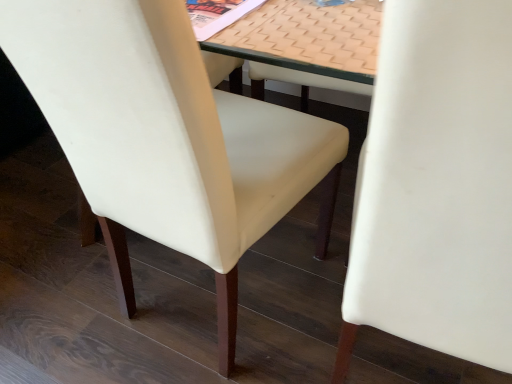
Question: Is the surface of white leather chair at center, which ranks as the 1th chair in right-to-left order, in direct contact with white leather chair at center, marked as the first chair in a left-to-right arrangement?

Choices:
 (A) yes
 (B) no

Answer: (B)

Question: Is white leather chair at center, which ranks as the 1th chair in right-to-left order, facing away from white leather chair at center, marked as the 2th chair in a right-to-left arrangement?

Choices:
 (A) yes
 (B) no

Answer: (B)

Question: Is white leather chair at center, which ranks as the 1th chair in right-to-left order, not inside white leather chair at center, marked as the first chair in a left-to-right arrangement?

Choices:
 (A) no
 (B) yes

Answer: (B)

Question: Is the depth of white leather chair at center, which ranks as the 1th chair in right-to-left order, greater than that of white leather chair at center, marked as the first chair in a left-to-right arrangement?

Choices:
 (A) no
 (B) yes

Answer: (A)

Question: Considering the relative positions of white leather chair at center, which is counted as the 2th chair, starting from the left, and white leather chair at center, marked as the first chair in a left-to-right arrangement, in the image provided, is white leather chair at center, which is counted as the 2th chair, starting from the left, to the left of white leather chair at center, marked as the first chair in a left-to-right arrangement, from the viewer's perspective?

Choices:
 (A) yes
 (B) no

Answer: (B)

Question: Considering the positions of point (69, 66) and point (426, 284), is point (69, 66) closer or farther from the camera than point (426, 284)?

Choices:
 (A) farther
 (B) closer

Answer: (A)

Question: In terms of width, does white leather chair at center, marked as the first chair in a left-to-right arrangement, look wider or thinner when compared to white leather chair at center, which ranks as the 1th chair in right-to-left order?

Choices:
 (A) thin
 (B) wide

Answer: (A)

Question: From a real-world perspective, is white leather chair at center, marked as the first chair in a left-to-right arrangement, physically located above or below white leather chair at center, which is counted as the 2th chair, starting from the left?

Choices:
 (A) above
 (B) below

Answer: (B)

Question: Is white leather chair at center, marked as the first chair in a left-to-right arrangement, situated inside white leather chair at center, which is counted as the 2th chair, starting from the left, or outside?

Choices:
 (A) outside
 (B) inside

Answer: (A)

Question: Is point (116, 203) positioned closer to the camera than point (324, 19)?

Choices:
 (A) closer
 (B) farther

Answer: (B)

Question: Based on their positions, is white leather chair at center, marked as the first chair in a left-to-right arrangement, located to the left or right of beige textured mat at center?

Choices:
 (A) right
 (B) left

Answer: (B)

Question: From the image's perspective, is white leather chair at center, marked as the 2th chair in a right-to-left arrangement, positioned above or below beige textured mat at center?

Choices:
 (A) below
 (B) above

Answer: (A)

Question: Is white leather chair at center, marked as the 2th chair in a right-to-left arrangement, wider or thinner than beige textured mat at center?

Choices:
 (A) wide
 (B) thin

Answer: (A)

Question: In the image, is beige textured mat at center on the left side or the right side of white leather chair at center, which is counted as the 2th chair, starting from the left?

Choices:
 (A) left
 (B) right

Answer: (A)

Question: From the image's perspective, is beige textured mat at center above or below white leather chair at center, which is counted as the 2th chair, starting from the left?

Choices:
 (A) above
 (B) below

Answer: (A)